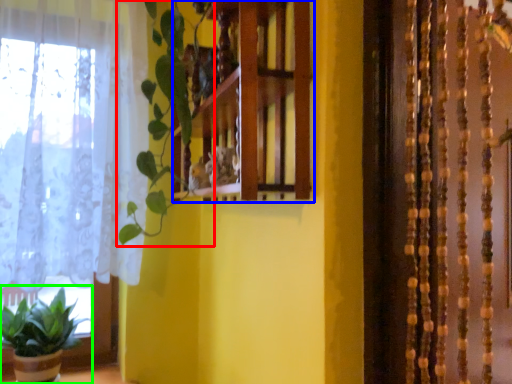
Question: Estimate the real-world distances between objects in this image. Which object is closer to vegetation (highlighted by a red box), shelf (highlighted by a blue box) or houseplant (highlighted by a green box)?

Choices:
 (A) shelf
 (B) houseplant

Answer: (A)